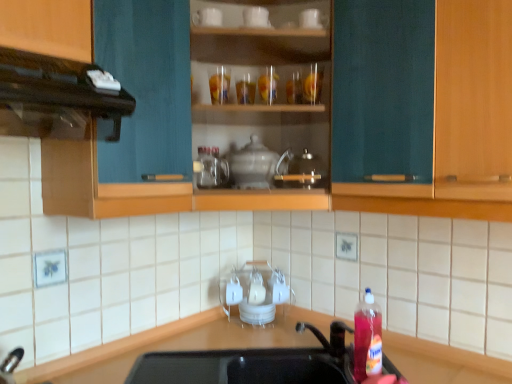
Question: Is black matte countertop at lower center directly adjacent to black matte vent at upper left?

Choices:
 (A) yes
 (B) no

Answer: (B)

Question: Does black matte countertop at lower center turn towards black matte vent at upper left?

Choices:
 (A) yes
 (B) no

Answer: (B)

Question: From the image's perspective, is black matte countertop at lower center located above black matte vent at upper left?

Choices:
 (A) no
 (B) yes

Answer: (A)

Question: Can you confirm if black matte countertop at lower center is bigger than black matte vent at upper left?

Choices:
 (A) yes
 (B) no

Answer: (A)

Question: Is black matte countertop at lower center outside of black matte vent at upper left?

Choices:
 (A) yes
 (B) no

Answer: (A)

Question: Is black matte countertop at lower center surrounding black matte vent at upper left?

Choices:
 (A) yes
 (B) no

Answer: (B)

Question: Can you confirm if translucent plastic bottle at lower right is positioned to the left of black matte vent at upper left?

Choices:
 (A) yes
 (B) no

Answer: (B)

Question: Is translucent plastic bottle at lower right closer to camera compared to black matte vent at upper left?

Choices:
 (A) no
 (B) yes

Answer: (A)

Question: Is translucent plastic bottle at lower right at the right side of black matte vent at upper left?

Choices:
 (A) no
 (B) yes

Answer: (B)

Question: Can you confirm if translucent plastic bottle at lower right is wider than black matte vent at upper left?

Choices:
 (A) no
 (B) yes

Answer: (A)

Question: Can you confirm if translucent plastic bottle at lower right is thinner than black matte vent at upper left?

Choices:
 (A) no
 (B) yes

Answer: (B)

Question: Is translucent plastic bottle at lower right positioned far away from black matte vent at upper left?

Choices:
 (A) yes
 (B) no

Answer: (B)

Question: Considering the relative sizes of teal wood cabinet at center and black matte countertop at lower center in the image provided, is teal wood cabinet at center taller than black matte countertop at lower center?

Choices:
 (A) yes
 (B) no

Answer: (A)